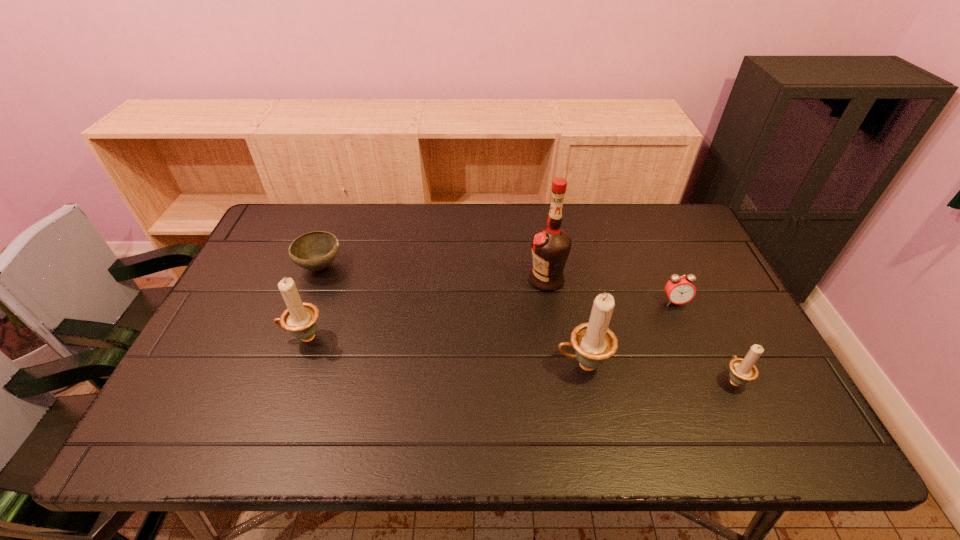
To make them evenly spaced by inserting another candle_holder among them, please locate a vacant spot for this new candle_holder. Please provide its 2D coordinates. Your answer should be formatted as a tuple, i.e. [(x, y)], where the tuple contains the x and y coordinates of a point satisfying the conditions above.

[(440, 350)]